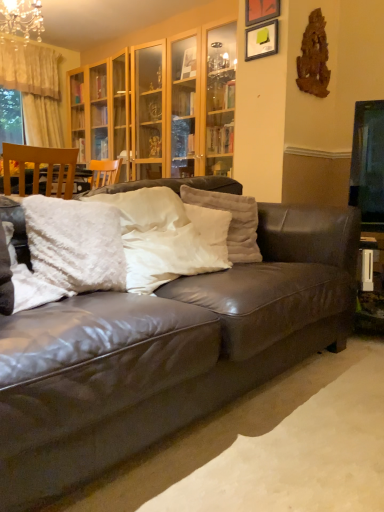
Where is `matte wooden picture frame at upper center, placed as the 2th picture frame when sorted from bottom to top`? matte wooden picture frame at upper center, placed as the 2th picture frame when sorted from bottom to top is located at coordinates (261, 11).

Measure the distance between point (x=249, y=41) and camera.

They are 2.52 meters apart.

What do you see at coordinates (231, 220) in the screenshot?
I see `white fluffy pillow at center, acting as the 4th pillow starting from the left` at bounding box center [231, 220].

Locate an element on the screen. white fluffy pillow at center, the 4th pillow from the right is located at coordinates (28, 281).

Locate an element on the screen. This screenshot has width=384, height=512. white fluffy pillow at center, the 2th pillow when ordered from left to right is located at coordinates (75, 243).

How different are the orientations of white fluffy pillow at center, which is counted as the first pillow, starting from the right, and white fluffy pillow at center, the 4th pillow from the right, in degrees?

The angle between the facing direction of white fluffy pillow at center, which is counted as the first pillow, starting from the right, and the facing direction of white fluffy pillow at center, the 4th pillow from the right, is 44.8 degrees.

Locate an element on the screen. pillow that is the 3rd object located in front of the white fluffy pillow at center, which is counted as the first pillow, starting from the right is located at coordinates (28, 281).

Does white fluffy pillow at center, which is counted as the first pillow, starting from the right, turn towards white fluffy pillow at center, the 1th pillow viewed from the left?

No.

Considering the relative sizes of matte black picture frame at upper center, which ranks as the second picture frame in top-to-bottom order, and white fluffy pillow at center, arranged as the second pillow when viewed from the right, in the image provided, is matte black picture frame at upper center, which ranks as the second picture frame in top-to-bottom order, wider than white fluffy pillow at center, arranged as the second pillow when viewed from the right,?

In fact, matte black picture frame at upper center, which ranks as the second picture frame in top-to-bottom order, might be narrower than white fluffy pillow at center, arranged as the second pillow when viewed from the right.

From a real-world perspective, relative to white fluffy pillow at center, arranged as the second pillow when viewed from the right, is matte black picture frame at upper center, which ranks as the second picture frame in top-to-bottom order, vertically above or below?

In terms of real-world spatial position, matte black picture frame at upper center, which ranks as the second picture frame in top-to-bottom order, is above white fluffy pillow at center, arranged as the second pillow when viewed from the right.

Could you tell me if white fluffy pillow at center, the 2th pillow when ordered from left to right, is turned towards wooden chair at left?

No, white fluffy pillow at center, the 2th pillow when ordered from left to right, is not aimed at wooden chair at left.

Which object is wider, white fluffy pillow at center, the third pillow positioned from the right, or wooden chair at left?

wooden chair at left is wider.

Which point is more forward, [99,255] or [61,188]?

The point [99,255] is closer to the camera.

Which of these two, white fluffy pillow at center, the 2th pillow when ordered from left to right, or wooden chair at left, is bigger?

With larger size is wooden chair at left.

From the picture: Which of these two, brown leather couch at center or crystal glass chandelier at upper left, stands shorter?

crystal glass chandelier at upper left.

Are brown leather couch at center and crystal glass chandelier at upper left making contact?

brown leather couch at center and crystal glass chandelier at upper left are clearly separated.

Looking at the image, does brown leather couch at center seem bigger or smaller compared to crystal glass chandelier at upper left?

Considering their sizes, brown leather couch at center takes up more space than crystal glass chandelier at upper left.

Is matte wooden picture frame at upper center, placed as the 2th picture frame when sorted from bottom to top, outside of matte black picture frame at upper center, which ranks as the first picture frame in bottom-to-top order?

matte wooden picture frame at upper center, placed as the 2th picture frame when sorted from bottom to top, is positioned outside matte black picture frame at upper center, which ranks as the first picture frame in bottom-to-top order.

From the image's perspective, would you say matte wooden picture frame at upper center, placed as the 2th picture frame when sorted from bottom to top, is shown under matte black picture frame at upper center, which ranks as the first picture frame in bottom-to-top order?

No, from the image's perspective, matte wooden picture frame at upper center, placed as the 2th picture frame when sorted from bottom to top, is not beneath matte black picture frame at upper center, which ranks as the first picture frame in bottom-to-top order.

Can you confirm if matte wooden picture frame at upper center, which appears as the first picture frame when viewed from the top, is positioned to the right of matte black picture frame at upper center, which ranks as the first picture frame in bottom-to-top order?

Indeed, matte wooden picture frame at upper center, which appears as the first picture frame when viewed from the top, is positioned on the right side of matte black picture frame at upper center, which ranks as the first picture frame in bottom-to-top order.

Is matte wooden picture frame at upper center, which appears as the first picture frame when viewed from the top, in contact with matte black picture frame at upper center, which ranks as the first picture frame in bottom-to-top order?

No.

From a real-world perspective, is crystal glass chandelier at upper left located higher than white fluffy pillow at center, acting as the 4th pillow starting from the left?

Yes, from a real-world perspective, crystal glass chandelier at upper left is on top of white fluffy pillow at center, acting as the 4th pillow starting from the left.

Is point (8, 1) closer or farther from the camera than point (253, 249)?

Point (8, 1).

In the image, is crystal glass chandelier at upper left positioned in front of or behind white fluffy pillow at center, which is counted as the first pillow, starting from the right?

crystal glass chandelier at upper left is positioned farther from the viewer than white fluffy pillow at center, which is counted as the first pillow, starting from the right.

Is crystal glass chandelier at upper left not inside brown leather couch at center?

Absolutely, crystal glass chandelier at upper left is external to brown leather couch at center.

Which of these two, crystal glass chandelier at upper left or brown leather couch at center, stands shorter?

crystal glass chandelier at upper left.

Measure the distance from crystal glass chandelier at upper left to brown leather couch at center.

They are 3.21 meters apart.

This screenshot has width=384, height=512. Identify the location of the 3rd pillow positioned below the white fluffy pillow at center, acting as the 4th pillow starting from the left (from the image's perspective). (28, 281).

From the image's perspective, count 1st picture frames upward from the white fluffy pillow at center, which ranks as the third pillow in left-to-right order, and point to it. Please provide its 2D coordinates.

[(261, 40)]

Considering their positions, is matte wooden picture frame at upper center, placed as the 2th picture frame when sorted from bottom to top, positioned further to white fluffy pillow at center, the 4th pillow from the right, than wooden chair at left?

Based on the image, matte wooden picture frame at upper center, placed as the 2th picture frame when sorted from bottom to top, appears to be further to white fluffy pillow at center, the 4th pillow from the right.

Considering their positions, is crystal glass chandelier at upper left positioned further to white fluffy pillow at center, arranged as the second pillow when viewed from the right, than white fluffy pillow at center, acting as the 4th pillow starting from the left?

The object further to white fluffy pillow at center, arranged as the second pillow when viewed from the right, is crystal glass chandelier at upper left.

Looking at the image, which one is located further to wooden chair at left, white fluffy pillow at center, which is counted as the first pillow, starting from the right, or brown leather couch at center?

Based on the image, brown leather couch at center appears to be further to wooden chair at left.

Considering their positions, is white fluffy pillow at center, the third pillow positioned from the right, positioned closer to white fluffy pillow at center, which is counted as the first pillow, starting from the right, than matte wooden picture frame at upper center, placed as the 2th picture frame when sorted from bottom to top?

white fluffy pillow at center, the third pillow positioned from the right, is closer to white fluffy pillow at center, which is counted as the first pillow, starting from the right.

Based on their spatial positions, is white fluffy pillow at center, which ranks as the third pillow in left-to-right order, or matte wooden picture frame at upper center, placed as the 2th picture frame when sorted from bottom to top, closer to white fluffy pillow at center, acting as the 4th pillow starting from the left?

white fluffy pillow at center, which ranks as the third pillow in left-to-right order.

Looking at the image, which one is located closer to matte wooden picture frame at upper center, placed as the 2th picture frame when sorted from bottom to top, crystal glass chandelier at upper left or matte black picture frame at upper center, which ranks as the first picture frame in bottom-to-top order?

The object closer to matte wooden picture frame at upper center, placed as the 2th picture frame when sorted from bottom to top, is matte black picture frame at upper center, which ranks as the first picture frame in bottom-to-top order.

Considering their positions, is white fluffy pillow at center, the 4th pillow from the right, positioned closer to white fluffy pillow at center, the third pillow positioned from the right, than matte black picture frame at upper center, which ranks as the first picture frame in bottom-to-top order?

white fluffy pillow at center, the 4th pillow from the right, is positioned closer to the anchor white fluffy pillow at center, the third pillow positioned from the right.

Based on their spatial positions, is white fluffy pillow at center, the 4th pillow from the right, or white fluffy pillow at center, the third pillow positioned from the right, further from matte black picture frame at upper center, which ranks as the first picture frame in bottom-to-top order?

Based on the image, white fluffy pillow at center, the 4th pillow from the right, appears to be further to matte black picture frame at upper center, which ranks as the first picture frame in bottom-to-top order.

Find the location of a particular element. This screenshot has width=384, height=512. chair between brown leather couch at center and matte wooden picture frame at upper center, placed as the 2th picture frame when sorted from bottom to top, from front to back is located at coordinates (38, 167).

Identify the location of pillow that lies between crystal glass chandelier at upper left and white fluffy pillow at center, which ranks as the third pillow in left-to-right order, from top to bottom. The width and height of the screenshot is (384, 512). (231, 220).

At what (x,y) coordinates should I click in order to perform the action: click on chair between matte wooden picture frame at upper center, which appears as the first picture frame when viewed from the top, and white fluffy pillow at center, the 1th pillow viewed from the left, vertically. Please return your answer as a coordinate pair (x, y). The height and width of the screenshot is (512, 384). Looking at the image, I should click on (38, 167).

You are a GUI agent. You are given a task and a screenshot of the screen. Output one action in this format:
    pyautogui.click(x=<x>, y=<y>)
    Task: Click on the picture frame between matte wooden picture frame at upper center, placed as the 2th picture frame when sorted from bottom to top, and white fluffy pillow at center, acting as the 4th pillow starting from the left, in the up-down direction
    This screenshot has height=512, width=384.
    Given the screenshot: What is the action you would take?
    pyautogui.click(x=261, y=40)